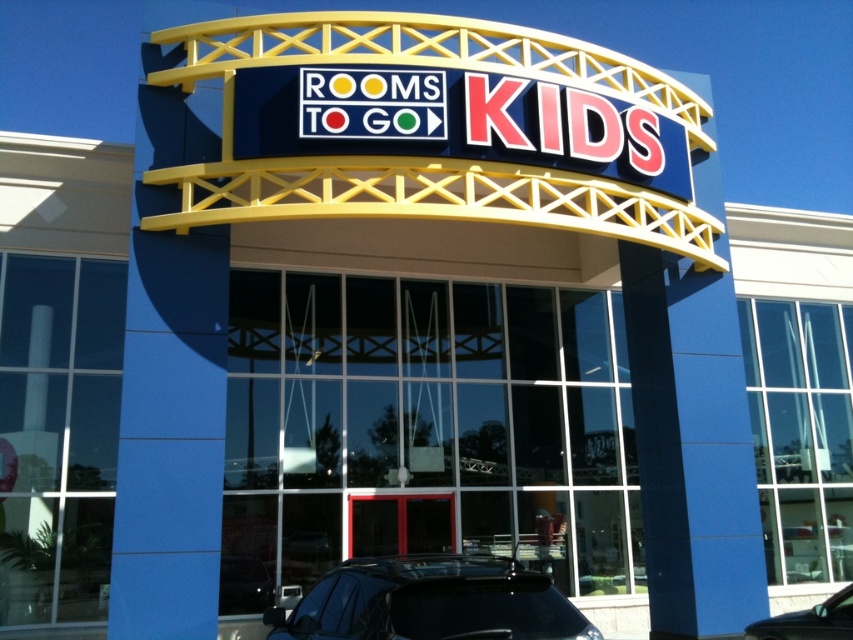
You are a delivery driver with a truck that is 4 meters long. You need to park your truck between the black matte car at lower center and the metallic glass door at center. Is there enough space for your truck?

The distance between the black matte car at lower center and the metallic glass door at center is 4.84 meters. Since your truck is 4 meters long, there is enough space to park it between them.

You are standing in front of the store and want to enter through the entrance. Where is the metallic glass door at center located?

The metallic glass door at center is located at point (399, 524).